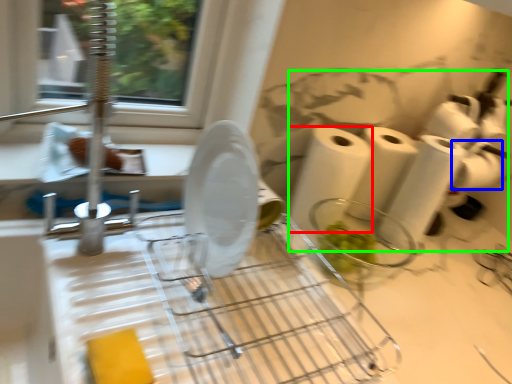
Question: Which object is the closest to the paper towel (highlighted by a red box)? Choose among these: toilet paper (highlighted by a blue box) or toilet paper (highlighted by a green box).

Choices:
 (A) toilet paper
 (B) toilet paper

Answer: (B)